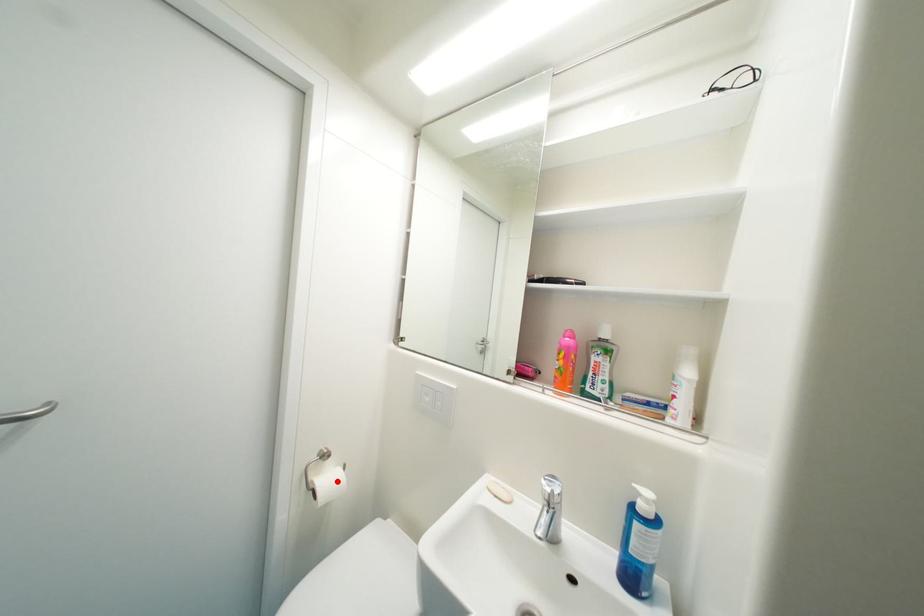
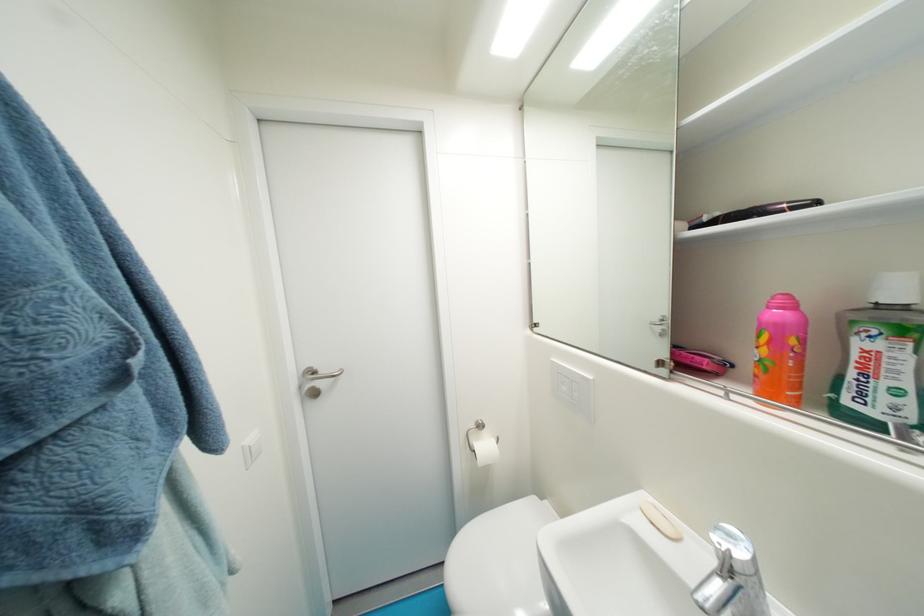
The point at the highlighted location is marked in the first image. Where is the corresponding point in the second image?

(492, 448)